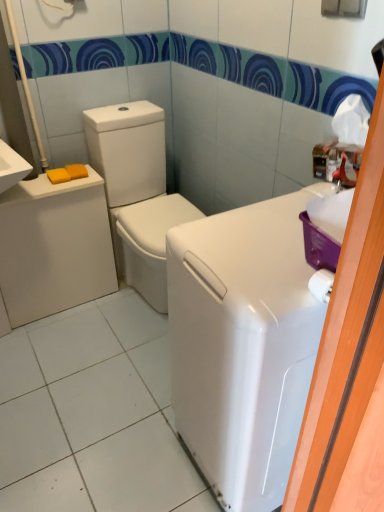
Find the location of a particular element. free space above matte white porcelain at left (from a real-world perspective) is located at coordinates (47, 182).